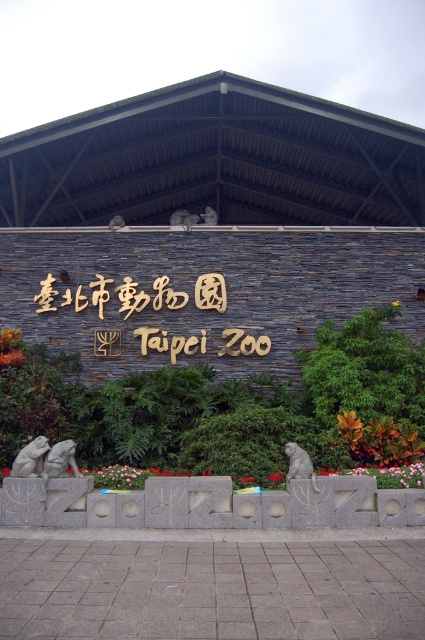
Question: From the image, what is the correct spatial relationship of stone statue at center in relation to brushed metal statue at center?

Choices:
 (A) above
 (B) below

Answer: (B)

Question: Which point is farther from the camera taking this photo?

Choices:
 (A) (54, 460)
 (B) (175, 221)
 (C) (31, 456)

Answer: (B)

Question: Which object is the farthest from the gray stone monkey at center?

Choices:
 (A) stone statue at upper center
 (B) gray stone frog at lower left

Answer: (A)

Question: Considering the relative positions of gray stone frog at lower left and stone statue at upper center in the image provided, where is gray stone frog at lower left located with respect to stone statue at upper center?

Choices:
 (A) above
 (B) below

Answer: (B)

Question: Can you confirm if brushed metal statue at center is wider than stone statue at upper center?

Choices:
 (A) yes
 (B) no

Answer: (A)

Question: Which of the following is the closest to the observer?

Choices:
 (A) (113, 227)
 (B) (289, 465)
 (C) (56, 307)

Answer: (B)